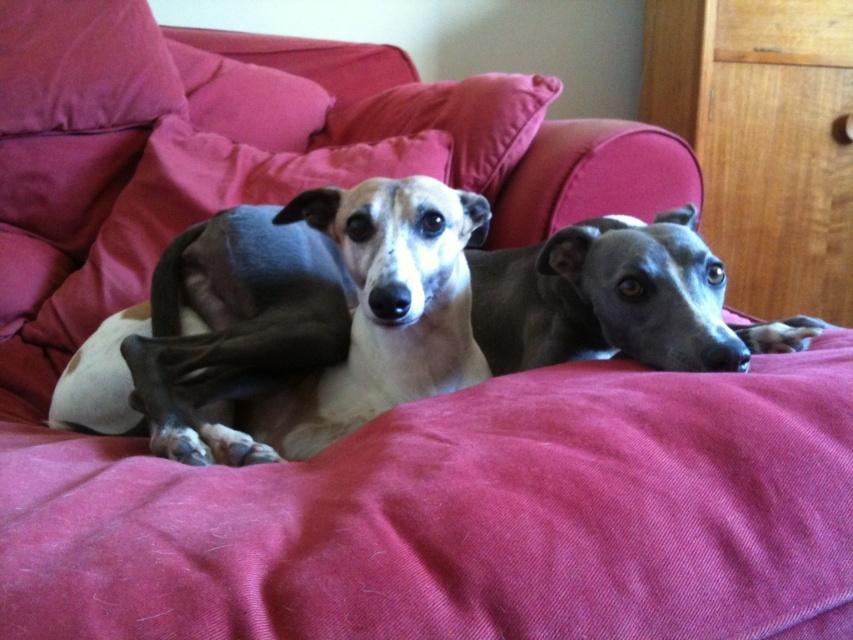
Describe the element at coordinates (373, 320) in the screenshot. The image size is (853, 640). I see `light brown fur at center` at that location.

Does light brown fur at center have a greater width compared to smooth gray dog at center?

Indeed, light brown fur at center has a greater width compared to smooth gray dog at center.

You are a GUI agent. You are given a task and a screenshot of the screen. Output one action in this format:
    pyautogui.click(x=<x>, y=<y>)
    Task: Click on the light brown fur at center
    
    Given the screenshot: What is the action you would take?
    pyautogui.click(x=373, y=320)

This screenshot has width=853, height=640. I want to click on light brown fur at center, so [373, 320].

Is velvety red dog bed at center taller than light brown fur at center?

Incorrect, velvety red dog bed at center's height is not larger of light brown fur at center's.

Between point (769, 364) and point (450, 360), which one is positioned in front?

Point (769, 364) is in front.

Locate an element on the screen. The width and height of the screenshot is (853, 640). velvety red dog bed at center is located at coordinates (456, 515).

Find the location of a particular element. velvety red dog bed at center is located at coordinates (456, 515).

Which is more to the right, velvety pink pillow at left or velvet cushion at upper center?

From the viewer's perspective, velvet cushion at upper center appears more on the right side.

Is velvety pink pillow at left positioned before velvet cushion at upper center?

Yes, velvety pink pillow at left is in front of velvet cushion at upper center.

Locate an element on the screen. Image resolution: width=853 pixels, height=640 pixels. velvety pink pillow at left is located at coordinates (202, 209).